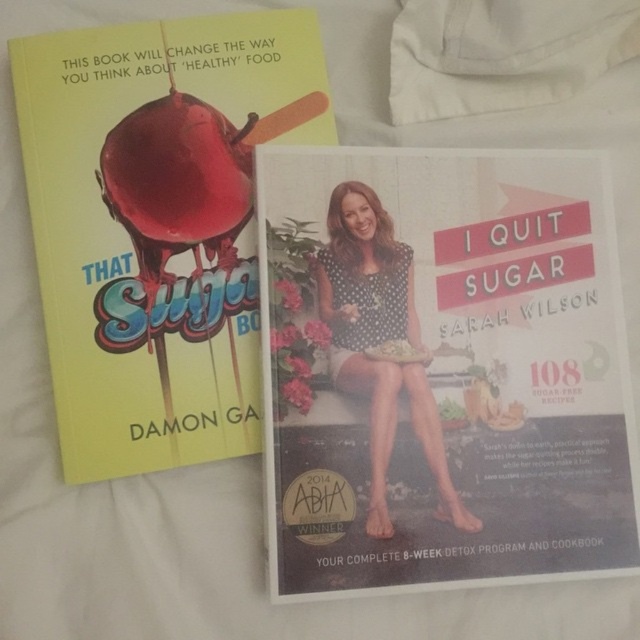
You are organizing a bookshelf and see the matte black book at lower right and the polka dot fabric at center. Which object is positioned to the right of the other?

The matte black book at lower right is to the right of the polka dot fabric at center.

You are organizing a bookshelf and need to place both the matte black book at lower right and the yellow matte book at upper left. The shelf has a maximum length of 10 inches. Can both books fit side by side on the shelf without overlapping?

The distance between the matte black book at lower right and yellow matte book at upper left is 6.40 inches. Since the shelf is 10 inches long, there is enough space to place both books side by side as 6.40 inches is less than 10 inches.